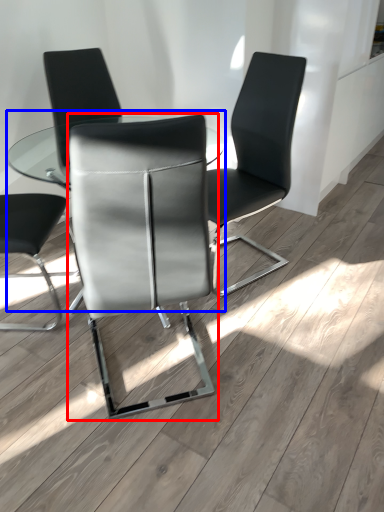
Question: Which object appears farthest to the camera in this image, chair (highlighted by a red box) or table (highlighted by a blue box)?

Choices:
 (A) chair
 (B) table

Answer: (B)